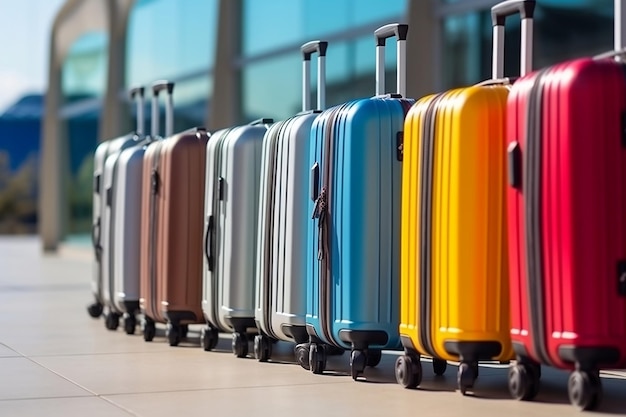
Identify the location of handles. (134, 90), (156, 87), (317, 45), (390, 30), (495, 13), (617, 25).